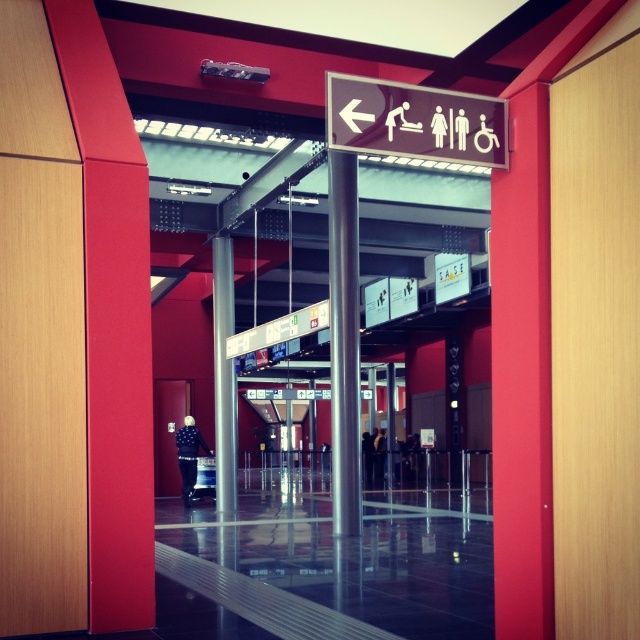
You are a traveler standing at the doorway and looking towards the brown plastic sign at upper center and the metallic silver pole at center. Which object is shorter?

The brown plastic sign at upper center is shorter than the metallic silver pole at center.